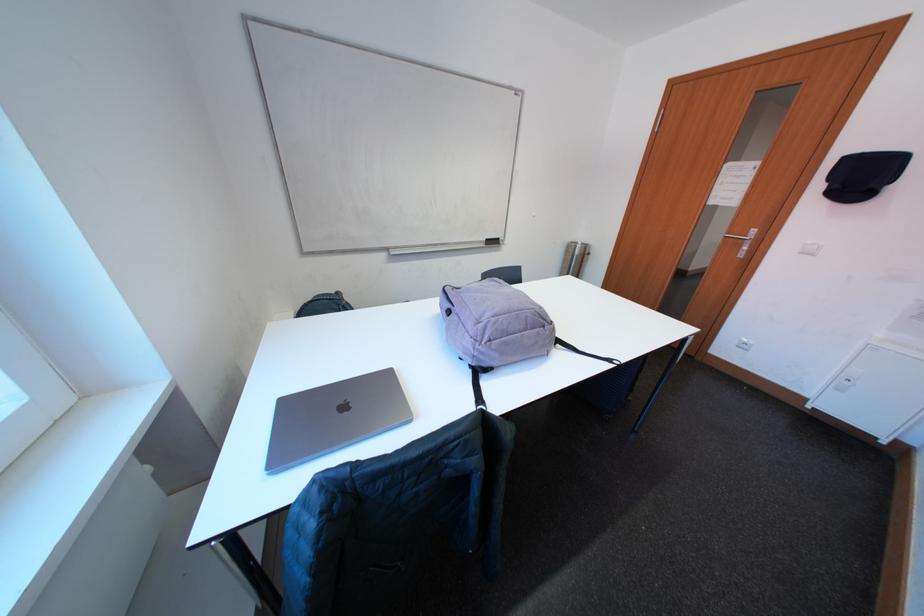
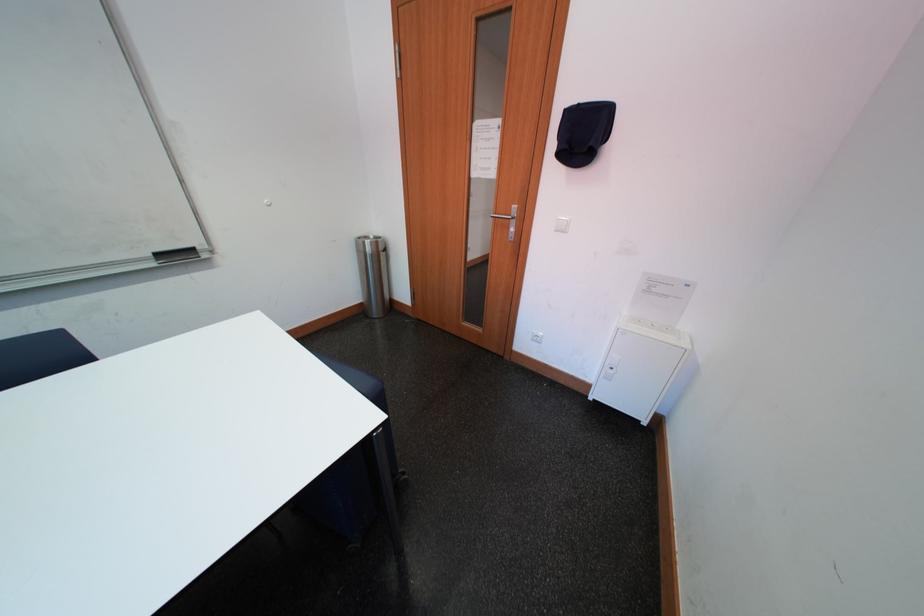
Consider the image. What movement of the cameraman would produce the second image?

The movement direction of the cameraman is right, forward.